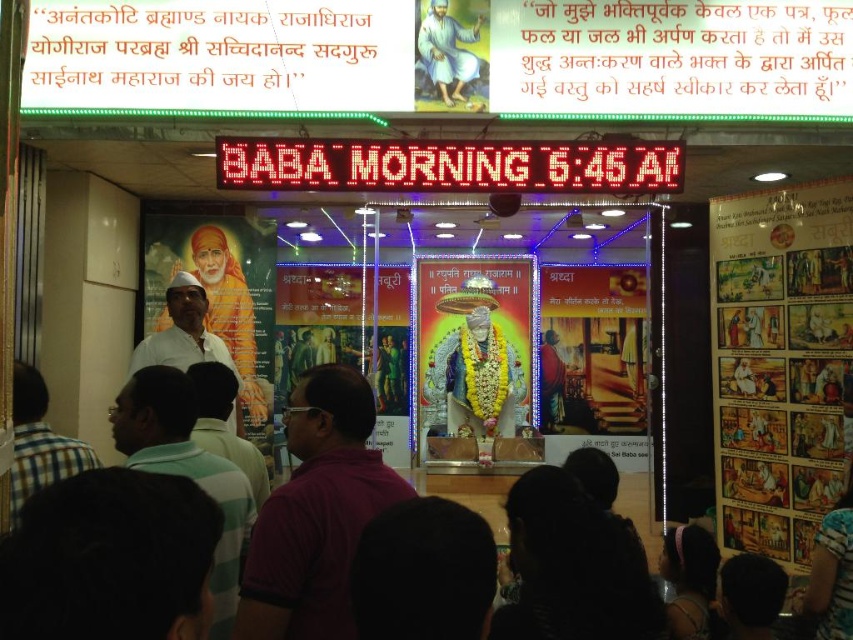
Question: Can you confirm if white cloth at upper center is thinner than white cotton shirt at center?

Choices:
 (A) no
 (B) yes

Answer: (B)

Question: Which object appears farthest from the camera in this image?

Choices:
 (A) matte gold statue at center
 (B) matte paper poster at right

Answer: (A)

Question: Can you confirm if white cloth at upper center is thinner than white cotton shirt at center?

Choices:
 (A) yes
 (B) no

Answer: (A)

Question: Considering the real-world distances, which object is farthest from the plaid shirt at lower left?

Choices:
 (A) white cloth at upper center
 (B) matte gold statue at center

Answer: (B)

Question: Can you confirm if white cloth at upper center is positioned to the left of white cotton shirt at center?

Choices:
 (A) yes
 (B) no

Answer: (B)

Question: Among these points, which one is nearest to the camera?

Choices:
 (A) (91, 467)
 (B) (329, 636)

Answer: (B)